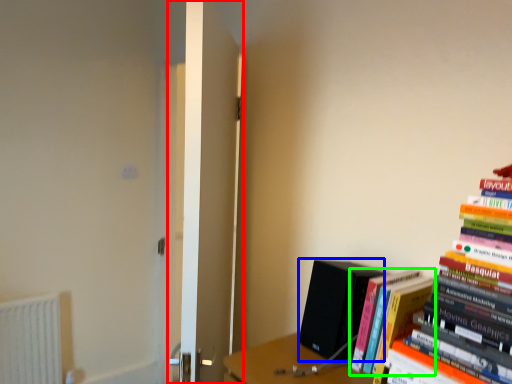
Question: Based on their relative distances, which object is nearer to door (highlighted by a red box)? Choose from paperback book (highlighted by a blue box) and book (highlighted by a green box).

Choices:
 (A) paperback book
 (B) book

Answer: (A)